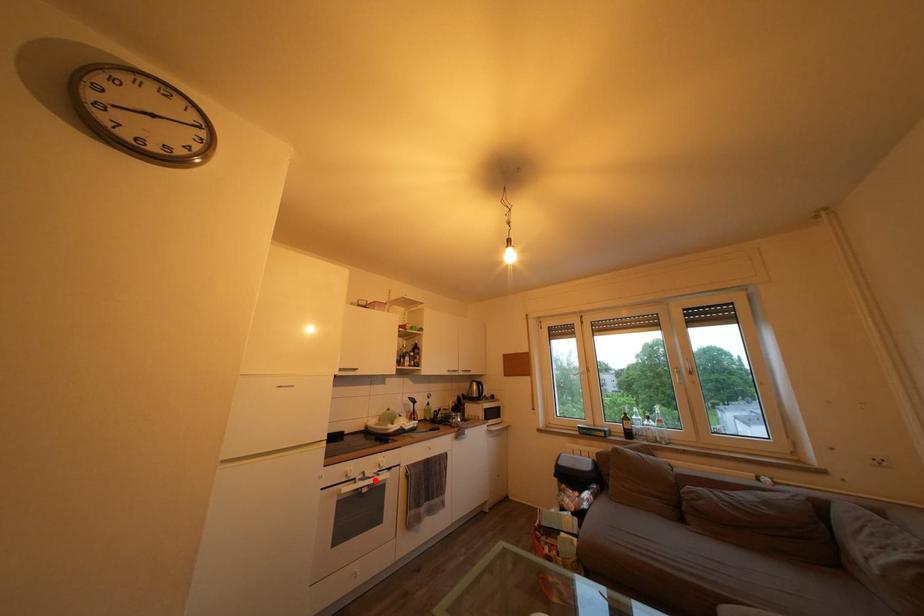
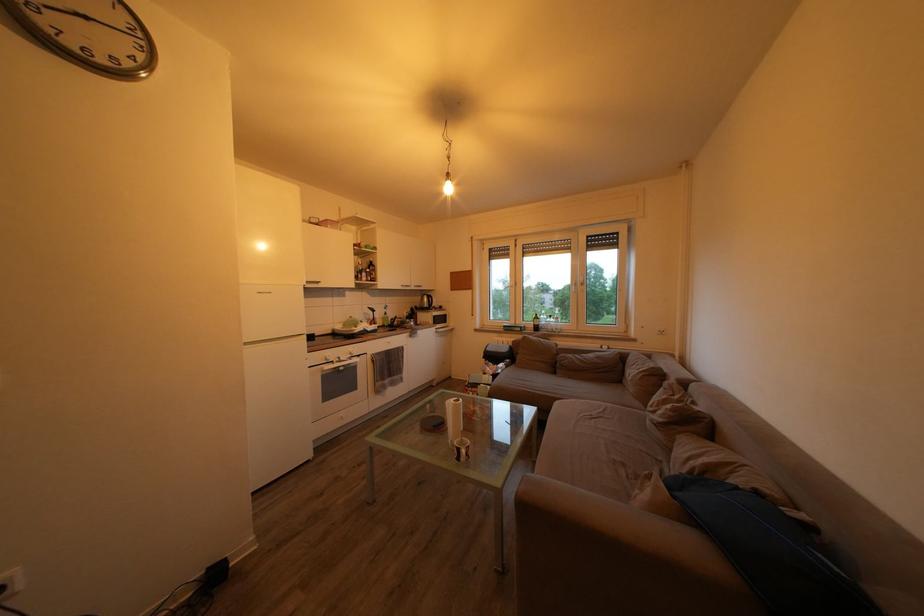
Question: I am providing you with two images of the same scene from different viewpoints. A red point is shown in image1. For the corresponding object point in image2, is it positioned nearer or farther from the camera?

Choices:
 (A) Nearer
 (B) Farther

Answer: (A)